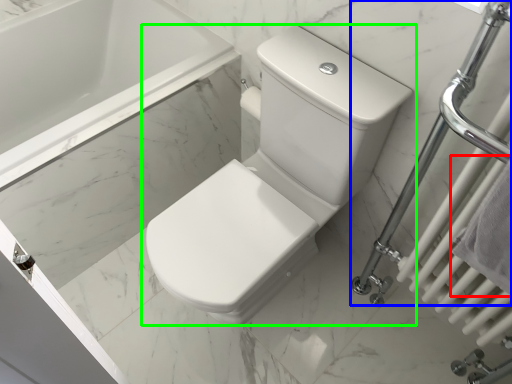
Question: Which is farther away from bath towel (highlighted by a red box)? shower (highlighted by a blue box) or toilet (highlighted by a green box)?

Choices:
 (A) shower
 (B) toilet

Answer: (B)